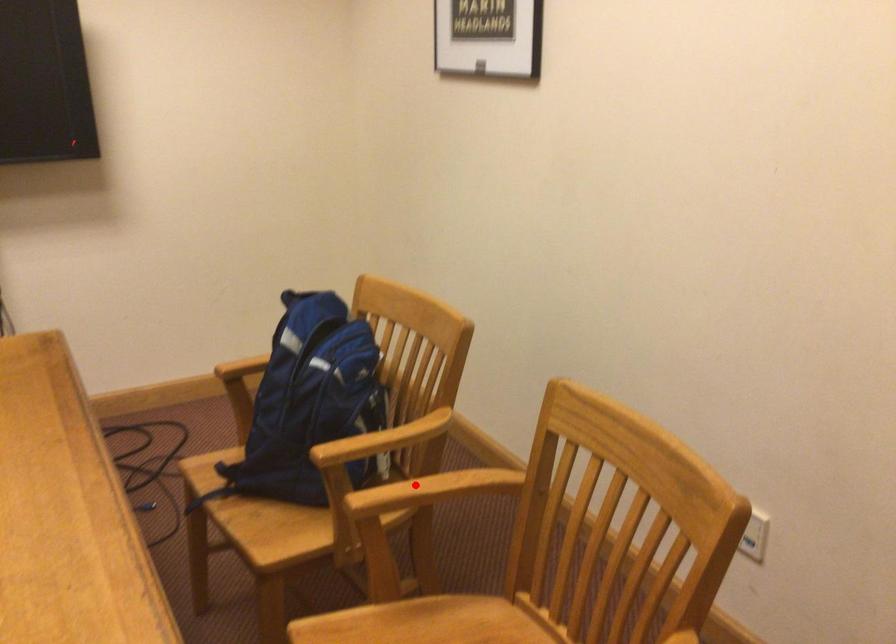
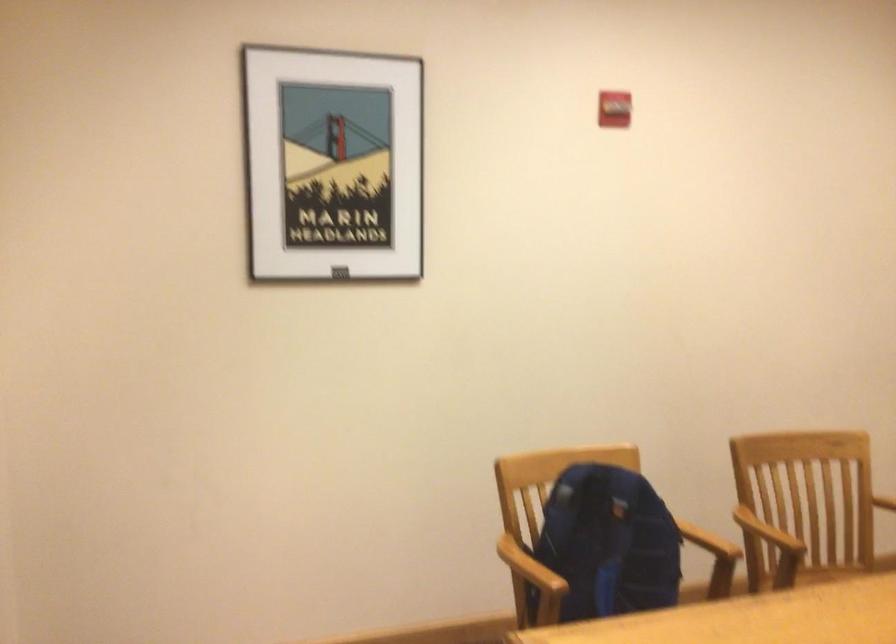
Question: I am providing you with two images of the same scene from different viewpoints. A red point is shown in image1. For the corresponding object point in image2, is it positioned nearer or farther from the camera?

Choices:
 (A) Nearer
 (B) Farther

Answer: (B)